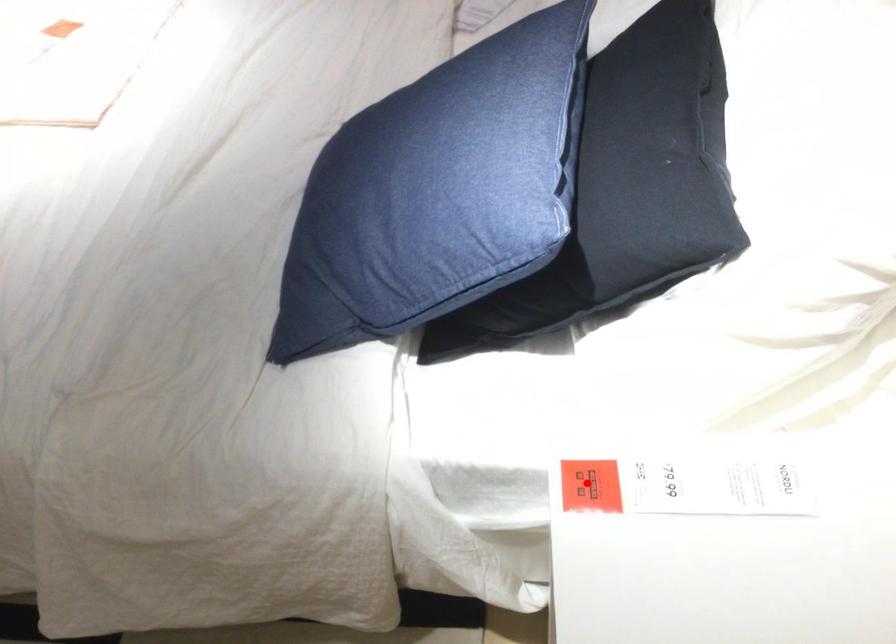
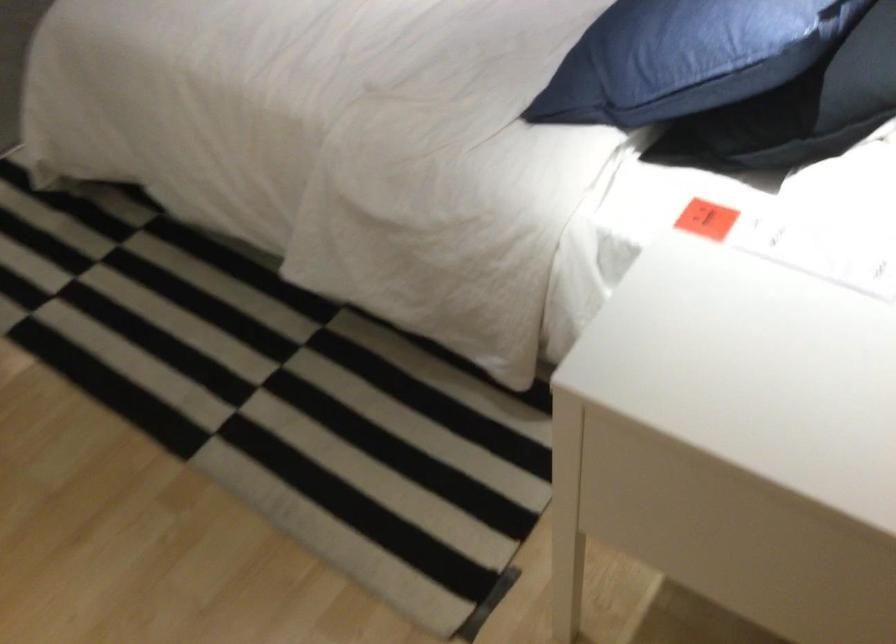
Find the pixel in the second image that matches the highlighted location in the first image.

(707, 219)